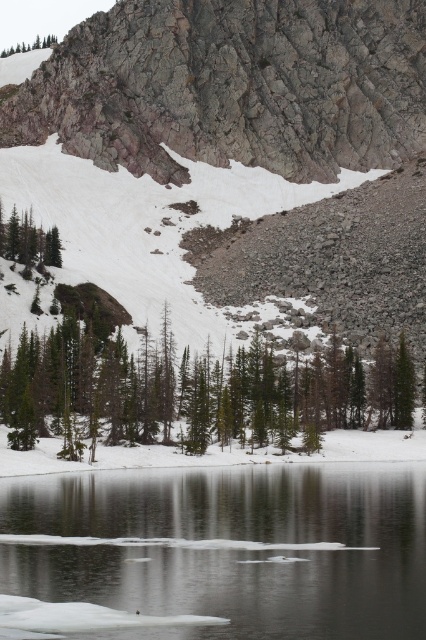
You are standing at the edge of the lake and want to cross to the other side. You notice the clear ice at lower center. Based on its position, can you determine if this ice is safe to walk on compared to other areas of the lake?

The clear ice at lower center is located at point (227, 547), which is a specific coordinate on the lake. However, without additional information about the thickness or condition of the ice at that point compared to other areas, it is impossible to determine its safety for walking.

You are standing at the edge of the lake and see the point marked by coordinates point [227,547]. What is located at that point?

The point [227,547] marks the location of clear ice at lower center.

Consider the image. You are standing at the edge of the lake and notice the clear ice at lower center. Based on its position, which direction should you move to avoid stepping on the ice?

You should move away from the clear ice at lower center to avoid stepping on it. Since the ice is located at lower center, moving towards the upper or sides would keep you away from the icy area.